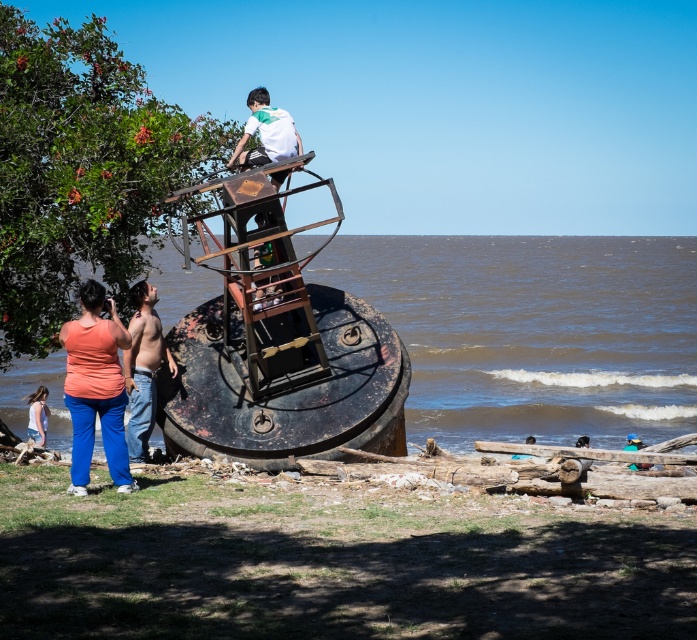
Can you confirm if rusty metal water at center is taller than denim shorts at lower left?

Yes.

Who is more forward, (427,280) or (29,413)?

Point (29,413) is in front.

Image resolution: width=697 pixels, height=640 pixels. Identify the location of rusty metal water at center. (533, 332).

In the scene shown: Who is more forward, (627, 394) or (144, 298)?

Positioned in front is point (144, 298).

Where is `rusty metal water at center`? The width and height of the screenshot is (697, 640). rusty metal water at center is located at coordinates (533, 332).

Is rusty metal water at center in front of green leafy tree at upper left?

That is False.

This screenshot has height=640, width=697. Find the location of `rusty metal water at center`. rusty metal water at center is located at coordinates (533, 332).

This screenshot has height=640, width=697. What do you see at coordinates (533, 332) in the screenshot?
I see `rusty metal water at center` at bounding box center [533, 332].

Locate an element on the screen. The width and height of the screenshot is (697, 640). rusty metal water at center is located at coordinates point(533,332).